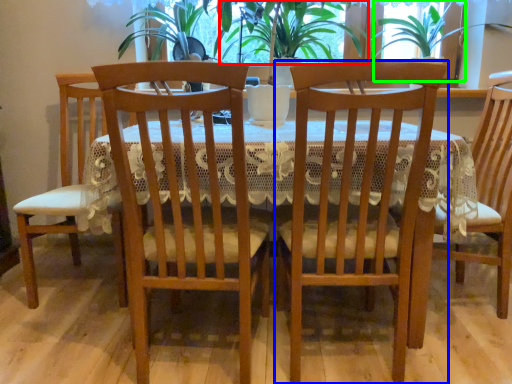
Question: Estimate the real-world distances between objects in this image. Which object is closer to plant (highlighted by a red box), chair (highlighted by a blue box) or window screen (highlighted by a green box)?

Choices:
 (A) chair
 (B) window screen

Answer: (B)